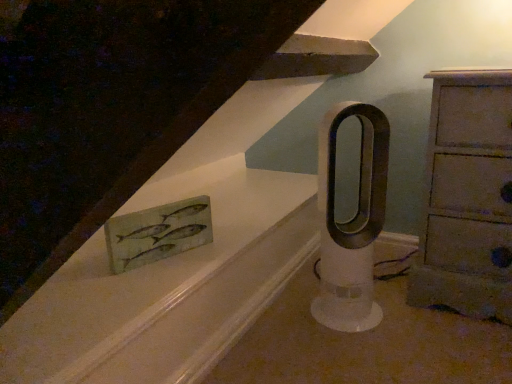
The height and width of the screenshot is (384, 512). What do you see at coordinates (468, 197) in the screenshot? I see `light brown wooden chest of drawers at right` at bounding box center [468, 197].

At what (x,y) coordinates should I click in order to perform the action: click on light brown wooden chest of drawers at right. Please return your answer as a coordinate pair (x, y). Looking at the image, I should click on (468, 197).

What is the approximate width of light brown wooden chest of drawers at right?

light brown wooden chest of drawers at right is 42.17 centimeters wide.

Measure the distance between light brown wooden chest of drawers at right and camera.

light brown wooden chest of drawers at right and camera are 98.92 centimeters apart.

Where is `light brown wooden chest of drawers at right`? This screenshot has width=512, height=384. light brown wooden chest of drawers at right is located at coordinates (468, 197).